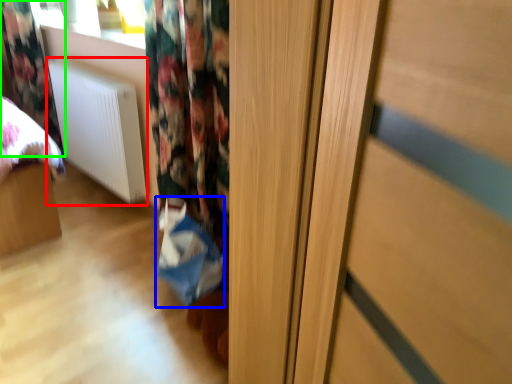
Question: Considering the real-world distances, which object is closest to radiator (highlighted by a red box)? shopping bag (highlighted by a blue box) or curtain (highlighted by a green box).

Choices:
 (A) shopping bag
 (B) curtain

Answer: (B)